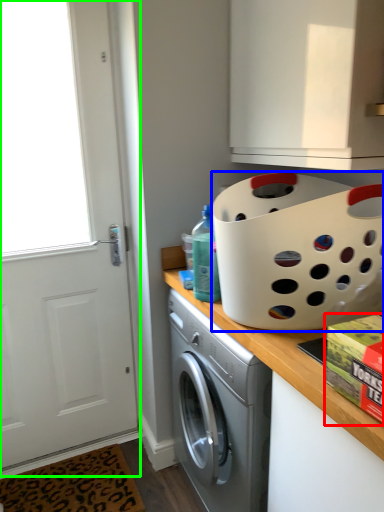
Question: Based on their relative distances, which object is nearer to box (highlighted by a red box)? Choose from basket (highlighted by a blue box) and screen door (highlighted by a green box).

Choices:
 (A) basket
 (B) screen door

Answer: (A)